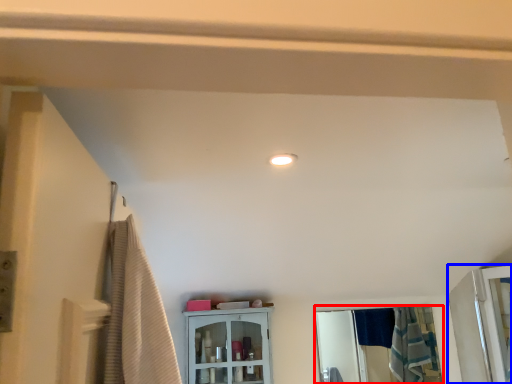
Question: Which of the following is the farthest to the observer, mirror (highlighted by a red box) or screen door (highlighted by a blue box)?

Choices:
 (A) mirror
 (B) screen door

Answer: (A)